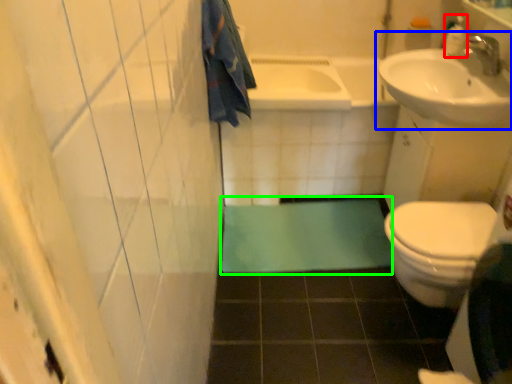
Question: Which object is the farthest from toiletry (highlighted by a red box)? Choose among these: sink (highlighted by a blue box) or bath mat (highlighted by a green box).

Choices:
 (A) sink
 (B) bath mat

Answer: (B)